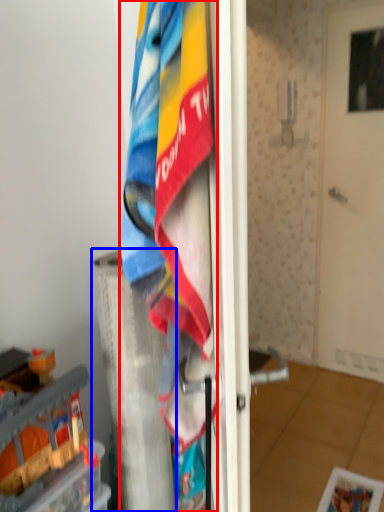
Question: Which of the following is the closest to the observer, towel (highlighted by a red box) or pillar (highlighted by a blue box)?

Choices:
 (A) towel
 (B) pillar

Answer: (A)